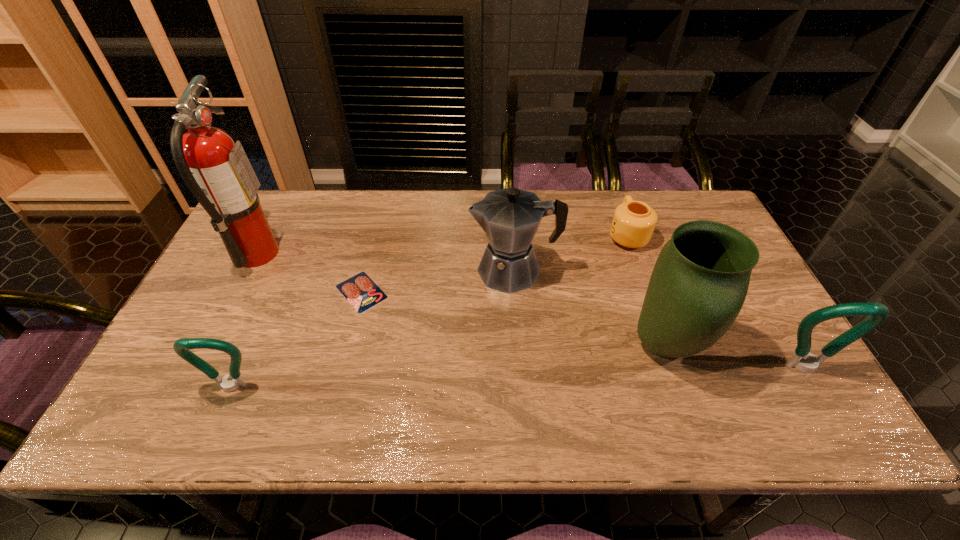
Find the location of a particular element. The height and width of the screenshot is (540, 960). free space between the fourth object from left to right and the tallest object is located at coordinates (385, 262).

Locate an element on the screen. This screenshot has width=960, height=540. vacant area that lies between the right bottle opener and the tallest object is located at coordinates coord(531,311).

I want to click on vacant area between the second tallest object and the fire extinguisher, so click(x=461, y=300).

This screenshot has height=540, width=960. I want to click on unoccupied area between the shorter bottle opener and the coffeepot, so click(x=372, y=329).

Identify the location of vacant space that's between the shorter bottle opener and the rightmost object. (517, 378).

This screenshot has width=960, height=540. Identify the location of free space between the rightmost object and the third shortest object. (517, 378).

The image size is (960, 540). Identify the location of empty space that is in between the shortest object and the taller bottle opener. (583, 330).

Locate an element on the screen. The image size is (960, 540). unoccupied position between the shortest object and the tallest object is located at coordinates (309, 273).

Where is `blank region between the third object from left to right and the taller bottle opener`? blank region between the third object from left to right and the taller bottle opener is located at coordinates (583, 330).

This screenshot has height=540, width=960. I want to click on object that stands as the sixth closest to the fifth object from right to left, so click(802, 359).